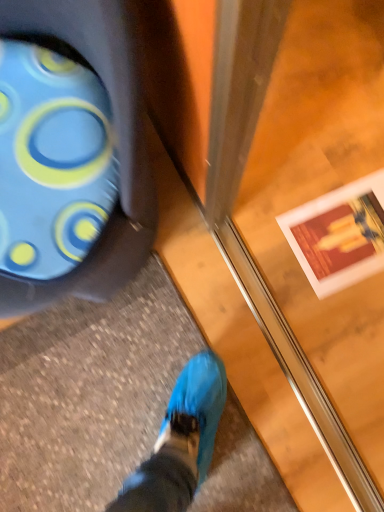
What do you see at coordinates (52, 161) in the screenshot?
I see `blue rubber boot at lower left` at bounding box center [52, 161].

Measure the distance between point (33, 232) and camera.

Point (33, 232) is 24.53 inches from camera.

I want to click on blue rubber boot at lower left, so click(52, 161).

Measure the distance between transparent glass screen door at center and camera.

A distance of 34.70 inches exists between transparent glass screen door at center and camera.

The image size is (384, 512). What do you see at coordinates (313, 310) in the screenshot?
I see `transparent glass screen door at center` at bounding box center [313, 310].

You are a GUI agent. You are given a task and a screenshot of the screen. Output one action in this format:
    pyautogui.click(x=<x>, y=<y>)
    Task: Click on the transparent glass screen door at center
    The height and width of the screenshot is (512, 384).
    Given the screenshot: What is the action you would take?
    pyautogui.click(x=313, y=310)

Identify the location of blue rubber boot at lower left. The height and width of the screenshot is (512, 384). (52, 161).

Can you confirm if transparent glass screen door at center is positioned to the right of blue rubber boot at lower left?

Yes.

Is the depth of transparent glass screen door at center less than that of blue rubber boot at lower left?

Yes.

Is point (336, 83) positioned in front of point (44, 77)?

No, (336, 83) is further to viewer.

From the image's perspective, would you say transparent glass screen door at center is shown under blue rubber boot at lower left?

Yes, from the image's perspective, transparent glass screen door at center is below blue rubber boot at lower left.

From a real-world perspective, is transparent glass screen door at center located beneath blue rubber boot at lower left?

No, from a real-world perspective, transparent glass screen door at center is not under blue rubber boot at lower left.

Can you confirm if transparent glass screen door at center is wider than blue rubber boot at lower left?

No.

Who is taller, transparent glass screen door at center or blue rubber boot at lower left?

transparent glass screen door at center.

Can you confirm if transparent glass screen door at center is smaller than blue rubber boot at lower left?

No.

Which is correct: transparent glass screen door at center is inside blue rubber boot at lower left, or outside of it?

transparent glass screen door at center exists outside the volume of blue rubber boot at lower left.

Is transparent glass screen door at center placed right next to blue rubber boot at lower left?

No, transparent glass screen door at center is not making contact with blue rubber boot at lower left.

Does transparent glass screen door at center turn towards blue rubber boot at lower left?

Yes, transparent glass screen door at center is aimed at blue rubber boot at lower left.

What's the angular difference between transparent glass screen door at center and blue rubber boot at lower left's facing directions?

42.7 degrees.

Locate an element on the screen. This screenshot has width=384, height=512. screen door that is above the blue rubber boot at lower left (from a real-world perspective) is located at coordinates (313, 310).

Is blue rubber boot at lower left at the left side of transparent glass screen door at center?

Yes, blue rubber boot at lower left is to the left of transparent glass screen door at center.

Relative to transparent glass screen door at center, is blue rubber boot at lower left in front or behind?

Visually, blue rubber boot at lower left is located behind transparent glass screen door at center.

Is point (20, 65) positioned behind point (263, 169)?

No, (20, 65) is in front of (263, 169).

From the image's perspective, is blue rubber boot at lower left located above transparent glass screen door at center?

Yes.

From a real-world perspective, does blue rubber boot at lower left stand above transparent glass screen door at center?

No, from a real-world perspective, blue rubber boot at lower left is not above transparent glass screen door at center.

Can you confirm if blue rubber boot at lower left is thinner than transparent glass screen door at center?

No, blue rubber boot at lower left is not thinner than transparent glass screen door at center.

Considering the sizes of objects blue rubber boot at lower left and transparent glass screen door at center in the image provided, who is shorter, blue rubber boot at lower left or transparent glass screen door at center?

blue rubber boot at lower left is shorter.

Is blue rubber boot at lower left bigger or smaller than transparent glass screen door at center?

blue rubber boot at lower left is smaller than transparent glass screen door at center.

Is blue rubber boot at lower left positioned beyond the bounds of transparent glass screen door at center?

Yes, blue rubber boot at lower left is located beyond the bounds of transparent glass screen door at center.

Would you say blue rubber boot at lower left is a long distance from transparent glass screen door at center?

blue rubber boot at lower left is actually quite close to transparent glass screen door at center.

Is blue rubber boot at lower left facing away from transparent glass screen door at center?

No, transparent glass screen door at center is not at the back of blue rubber boot at lower left.

How many degrees apart are the facing directions of blue rubber boot at lower left and transparent glass screen door at center?

The angular difference between blue rubber boot at lower left and transparent glass screen door at center is 42.7 degrees.

Find the location of a particular element. The height and width of the screenshot is (512, 384). footwear that appears behind the transparent glass screen door at center is located at coordinates (52, 161).

At what (x,y) coordinates should I click in order to perform the action: click on footwear beneath the transparent glass screen door at center (from a real-world perspective). Please return your answer as a coordinate pair (x, y). This screenshot has height=512, width=384. Looking at the image, I should click on [x=52, y=161].

Image resolution: width=384 pixels, height=512 pixels. Identify the location of screen door lying below the blue rubber boot at lower left (from the image's perspective). (313, 310).